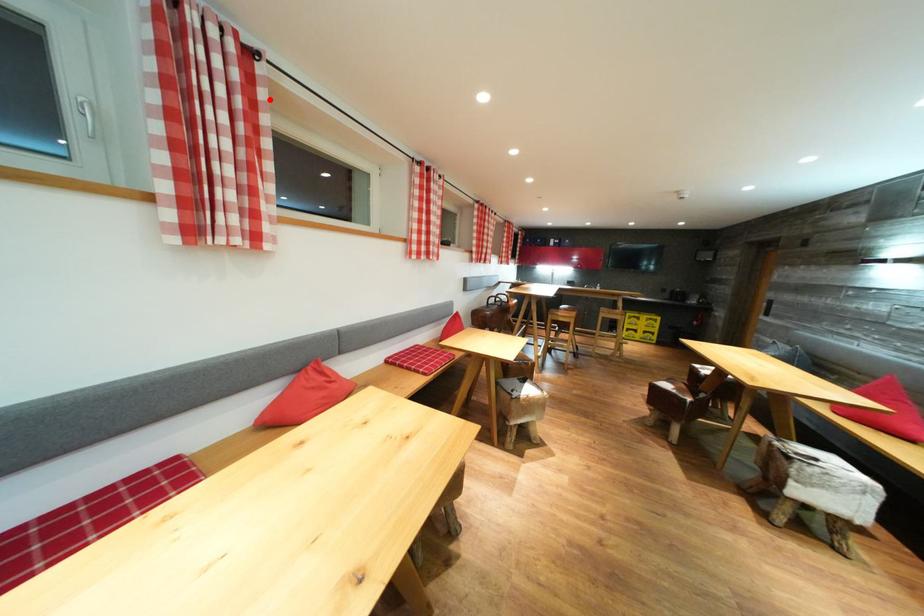
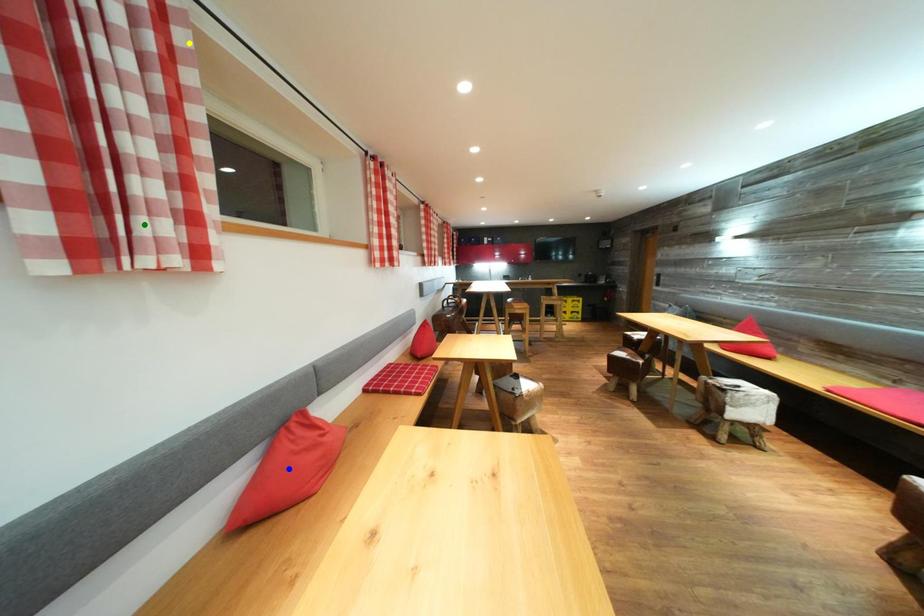
Question: I am providing you with two images of the same scene from different viewpoints. A red point is marked on the first image. You are given multiple points on the second image. Which mark in image 2 goes with the point in image 1?

Choices:
 (A) green point
 (B) blue point
 (C) yellow point

Answer: (C)